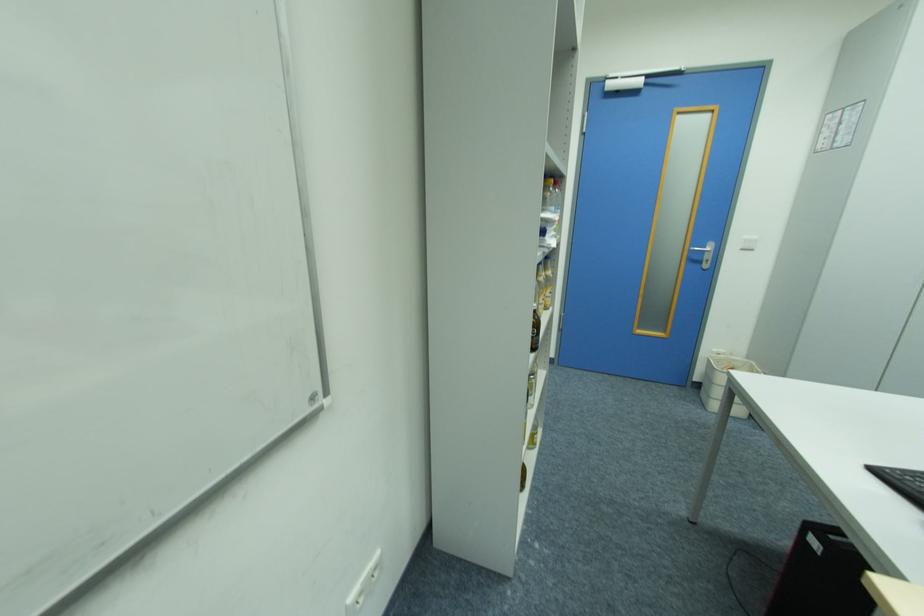
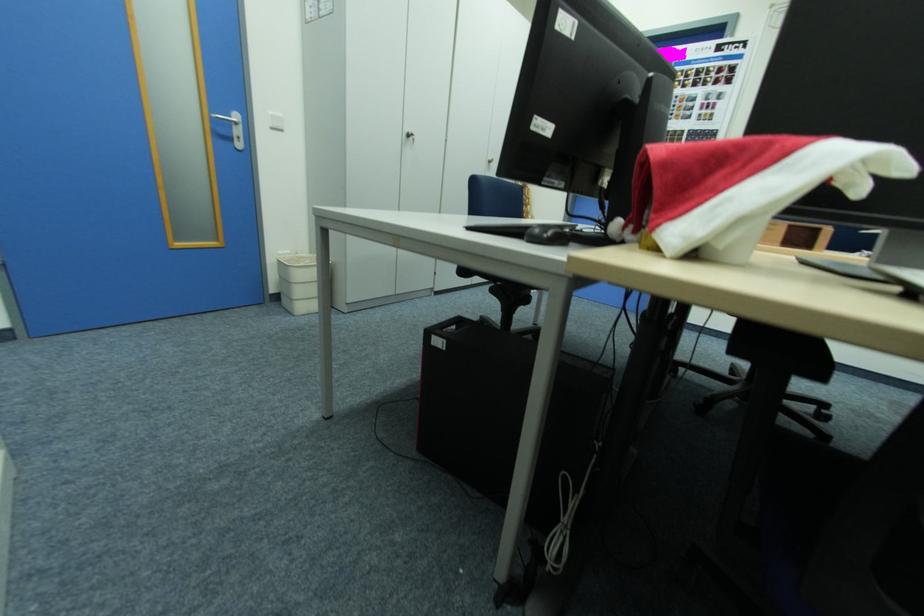
In the second image, find the point that corresponds to point (752, 238) in the first image.

(277, 114)